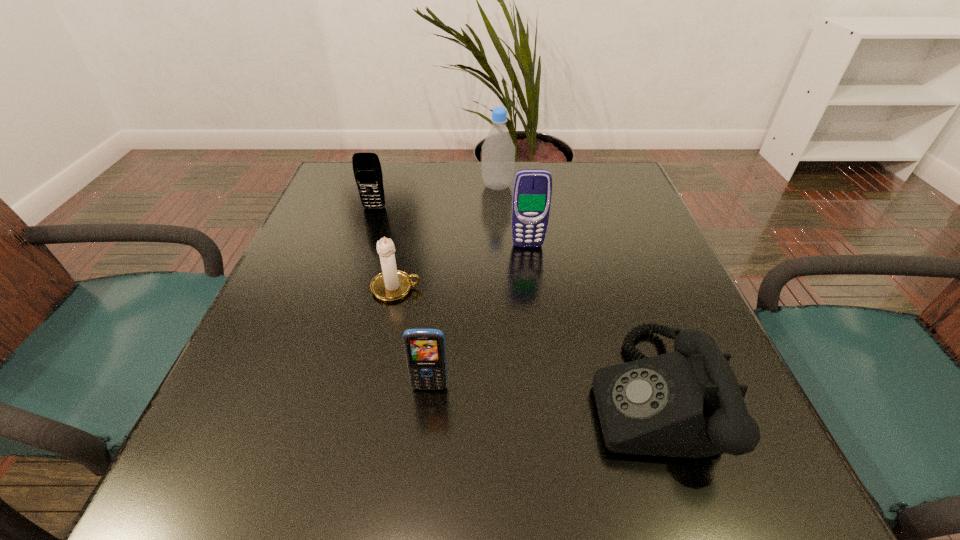
Find the location of a particular element. vacant area that lies between the third farthest object and the leftmost cellular telephone is located at coordinates (451, 227).

Identify which object is located as the third nearest to the telephone. Please provide its 2D coordinates. Your answer should be formatted as a tuple, i.e. [(x, y)], where the tuple contains the x and y coordinates of a point satisfying the conditions above.

[(392, 284)]

Identify which object is the closest to the tallest cellular telephone. Please provide its 2D coordinates. Your answer should be formatted as a tuple, i.e. [(x, y)], where the tuple contains the x and y coordinates of a point satisfying the conditions above.

[(498, 150)]

Point out which cellular telephone is positioned as the nearest to the farthest object. Please provide its 2D coordinates. Your answer should be formatted as a tuple, i.e. [(x, y)], where the tuple contains the x and y coordinates of a point satisfying the conditions above.

[(532, 190)]

Identify the location of cellular telephone identified as the closest to the farthest object. Image resolution: width=960 pixels, height=540 pixels. (532, 190).

Find the location of a particular element. The width and height of the screenshot is (960, 540). vacant region that satisfies the following two spatial constraints: 1. on the front side of the bottle; 2. on the handle side of the third nearest object is located at coordinates (503, 288).